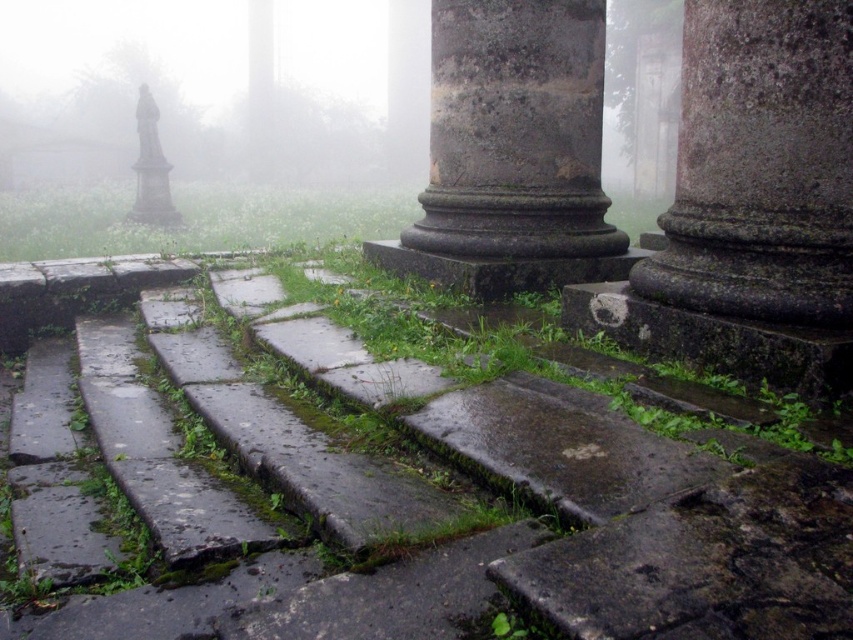
Does mossy stone steps at lower center appear on the left side of dark gray stone column at center?

Correct, you'll find mossy stone steps at lower center to the left of dark gray stone column at center.

Find the location of a particular element. The image size is (853, 640). mossy stone steps at lower center is located at coordinates (567, 524).

Between point (361, 360) and point (518, 211), which one is positioned in front?

Point (361, 360)

Find the location of a particular element. mossy stone steps at lower center is located at coordinates (567, 524).

Is the position of mossy stone steps at lower center more distant than that of rough stone pillar at center?

No, it is in front of rough stone pillar at center.

Is mossy stone steps at lower center bigger than rough stone pillar at center?

Correct, mossy stone steps at lower center is larger in size than rough stone pillar at center.

Between point (773, 596) and point (793, 44), which one is positioned behind?

The point (793, 44) is behind.

Locate an element on the screen. mossy stone steps at lower center is located at coordinates (567, 524).

Does mossy stone steps at lower center appear over stone statue at left?

No.

In the scene shown: Measure the distance between point (59,300) and camera.

A distance of 5.67 meters exists between point (59,300) and camera.

Is point (242, 531) behind point (161, 156)?

No, (242, 531) is closer to viewer.

Locate an element on the screen. mossy stone steps at lower center is located at coordinates (567, 524).